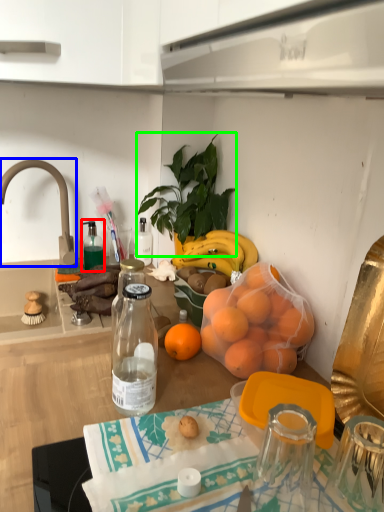
Question: Which object is the closest to the bottle (highlighted by a red box)? Choose among these: faucet (highlighted by a blue box) or houseplant (highlighted by a green box).

Choices:
 (A) faucet
 (B) houseplant

Answer: (A)